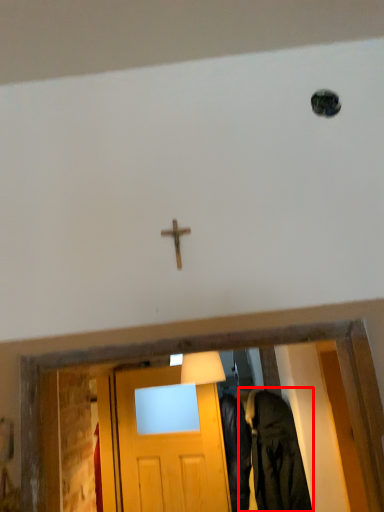
Question: From the image's perspective, where is clothing (annotated by the red box) located relative to crucifix?

Choices:
 (A) below
 (B) above

Answer: (A)